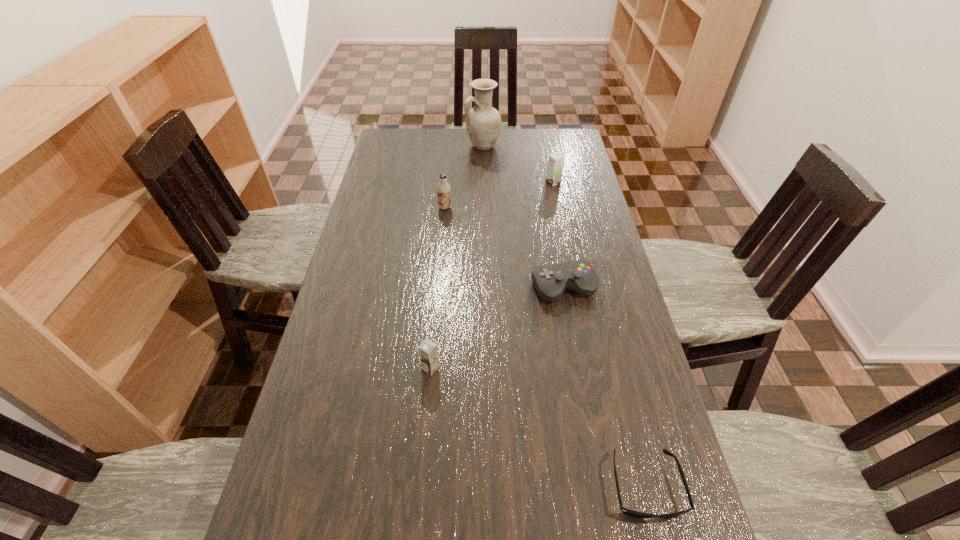
In the image, there is a desktop. Find the location of `vacant region at the far edge`. vacant region at the far edge is located at coordinates (462, 151).

In the image, there is a desktop. What are the coordinates of `vacant space at the left edge` in the screenshot? It's located at (410, 176).

Image resolution: width=960 pixels, height=540 pixels. Identify the location of vacant space at the right edge. (627, 530).

Locate an element on the screen. This screenshot has width=960, height=540. vacant space at the far left corner is located at coordinates (408, 129).

This screenshot has width=960, height=540. In the image, there is a desktop. What are the coordinates of `vacant space at the far right corner` in the screenshot? It's located at (569, 146).

This screenshot has height=540, width=960. I want to click on unoccupied area between the third nearest object and the rightmost chocolate milk, so click(559, 235).

Locate an element on the screen. empty location between the shortest chocolate milk and the fourth farthest object is located at coordinates (497, 328).

At what (x,y) coordinates should I click in order to perform the action: click on free space between the nearest chocolate milk and the farthest chocolate milk. Please return your answer as a coordinate pair (x, y). Looking at the image, I should click on (492, 275).

At what (x,y) coordinates should I click in order to perform the action: click on vacant space that's between the pottery and the sunglasses. Please return your answer as a coordinate pair (x, y). Looking at the image, I should click on (564, 316).

The height and width of the screenshot is (540, 960). I want to click on empty space between the third nearest object and the shortest chocolate milk, so coord(497,328).